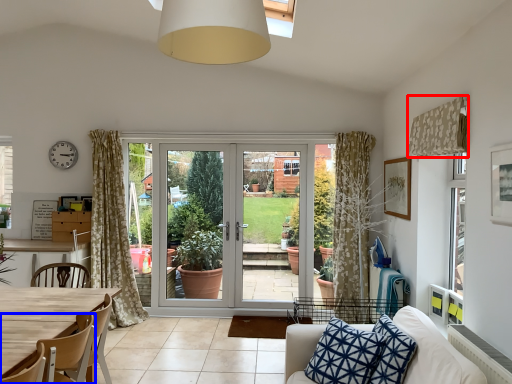
Question: Among these objects, which one is nearest to the camera, curtain (highlighted by a red box) or chair (highlighted by a blue box)?

Choices:
 (A) curtain
 (B) chair

Answer: (B)